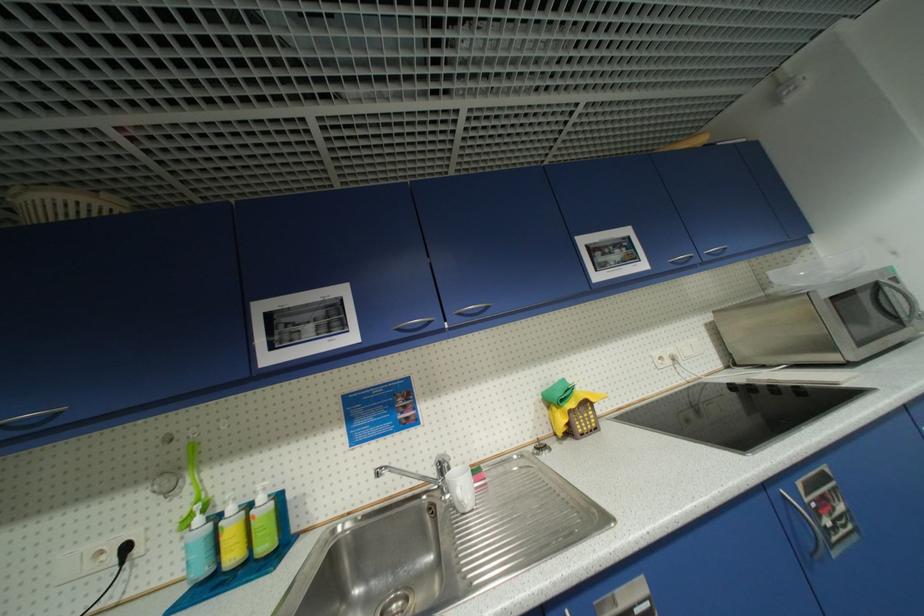
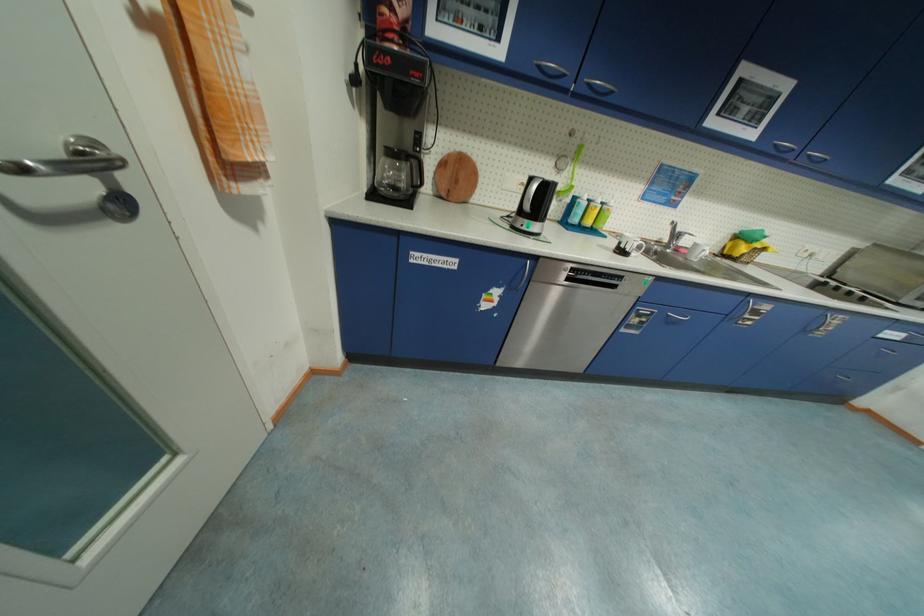
Locate, in the second image, the point that corresponds to pixel 193 490 in the first image.

(570, 175)